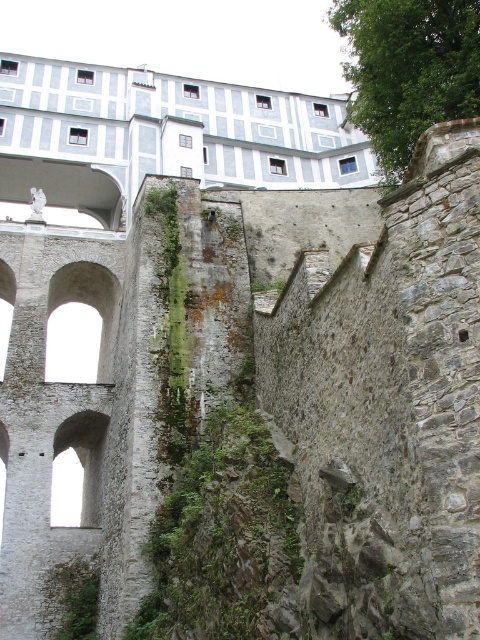
You are a drone operator tasked with capturing aerial footage of the historic stone structure. Your drone has a maximum flight range of 40 meters. If you are currently positioned at the green mossy wall at center, can you safely fly your drone to the green leafy tree at upper right without exceeding its range?

The distance between the green mossy wall at center and the green leafy tree at upper right is 39.21 meters, which is within the drone operator drone maximum flight range of 40 meters. Yes, the drone can safely fly to the green leafy tree at upper right without exceeding its range.

In the scene shown: You are an architect analyzing the historic stone structure. You notice the green mossy wall at center and the green leafy tree at upper right. Based on their positions, which object is higher up in the image?

The green leafy tree at upper right is higher up in the image because the green mossy wall at center is located below it.

You are an architect planning to install a decorative stone path between the green mossy wall at center and the green leafy tree at upper right. Given the space constraints, which object has a narrower width that might require adjustments in the path design?

The green mossy wall at center has a narrower width compared to the green leafy tree at upper right, so adjustments in the path design may be needed to accommodate its narrower space.